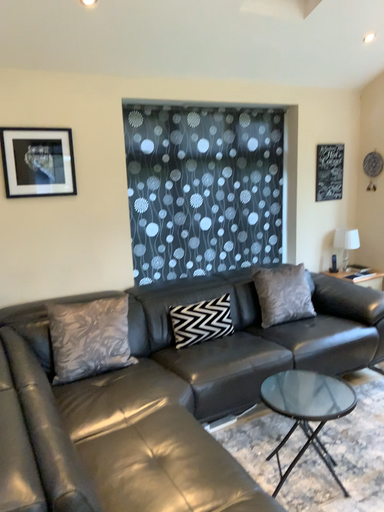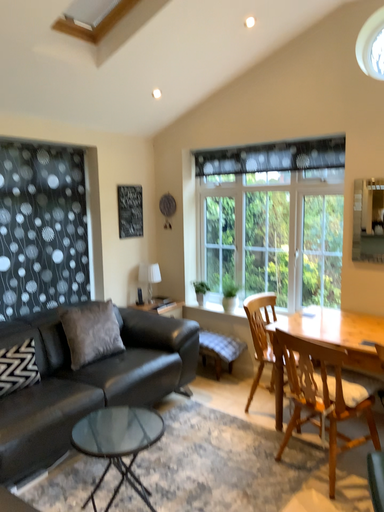
Question: How did the camera likely rotate when shooting the video?

Choices:
 (A) rotated right
 (B) rotated left

Answer: (A)